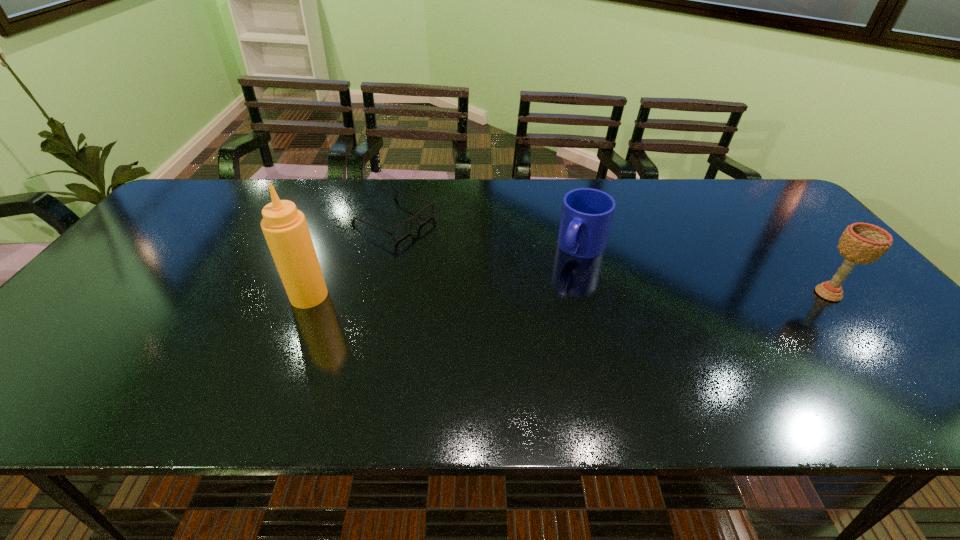
I want to click on vacant area that lies between the mug and the shortest object, so click(x=488, y=234).

Locate which object is the closest to the chalice. Please provide its 2D coordinates. Your answer should be formatted as a tuple, i.e. [(x, y)], where the tuple contains the x and y coordinates of a point satisfying the conditions above.

[(587, 213)]

Locate which object ranks second in proximity to the rightmost object. Please provide its 2D coordinates. Your answer should be formatted as a tuple, i.e. [(x, y)], where the tuple contains the x and y coordinates of a point satisfying the conditions above.

[(392, 233)]

Where is `vacant space that satisfies the following two spatial constraints: 1. on the front side of the spectacles; 2. on the left side of the mug`? This screenshot has height=540, width=960. vacant space that satisfies the following two spatial constraints: 1. on the front side of the spectacles; 2. on the left side of the mug is located at coordinates (388, 248).

You are a GUI agent. You are given a task and a screenshot of the screen. Output one action in this format:
    pyautogui.click(x=<x>, y=<y>)
    Task: Click on the free location that satisfies the following two spatial constraints: 1. on the front side of the second object from right to left; 2. on the left side of the shortest object
    The image size is (960, 540).
    Given the screenshot: What is the action you would take?
    pos(388,248)